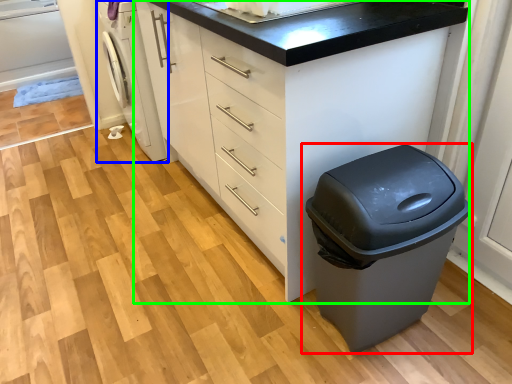
Question: Which object is the closest to the waste container (highlighted by a red box)? Choose among these: washing machine (highlighted by a blue box) or chest of drawers (highlighted by a green box).

Choices:
 (A) washing machine
 (B) chest of drawers

Answer: (B)